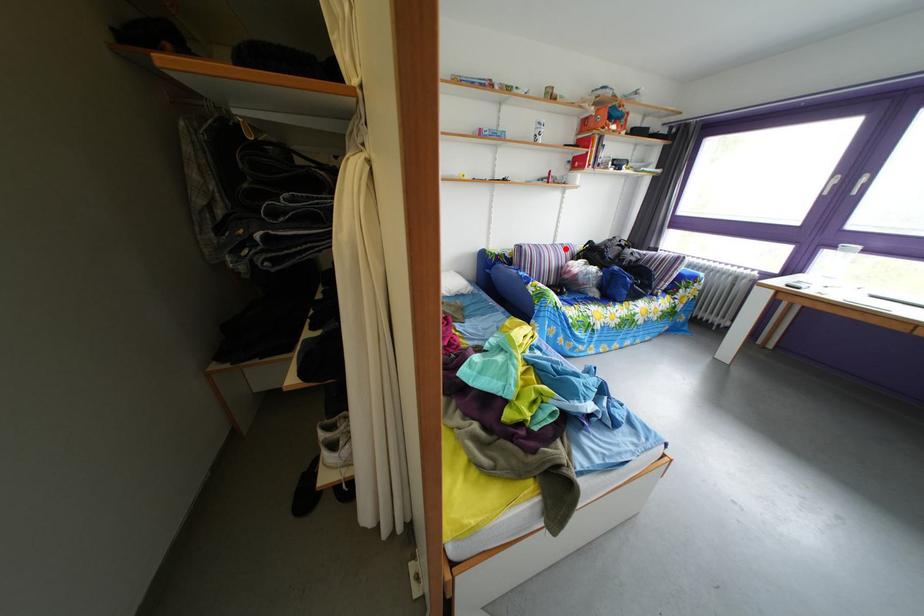
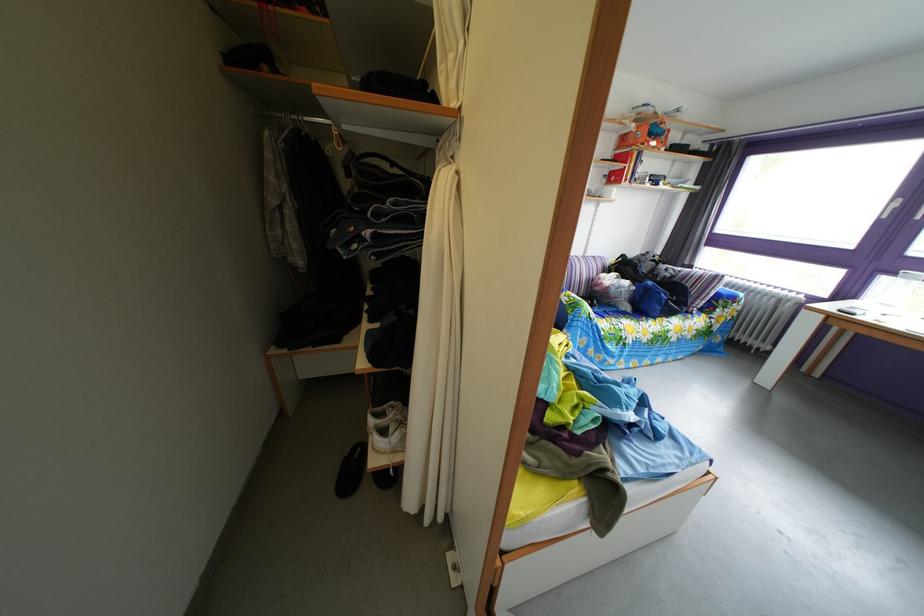
Question: I am providing you with two images of the same scene from different viewpoints. A red point is marked on the first image. Is the red point's position out of view in image 2?

Choices:
 (A) Yes
 (B) No

Answer: (B)